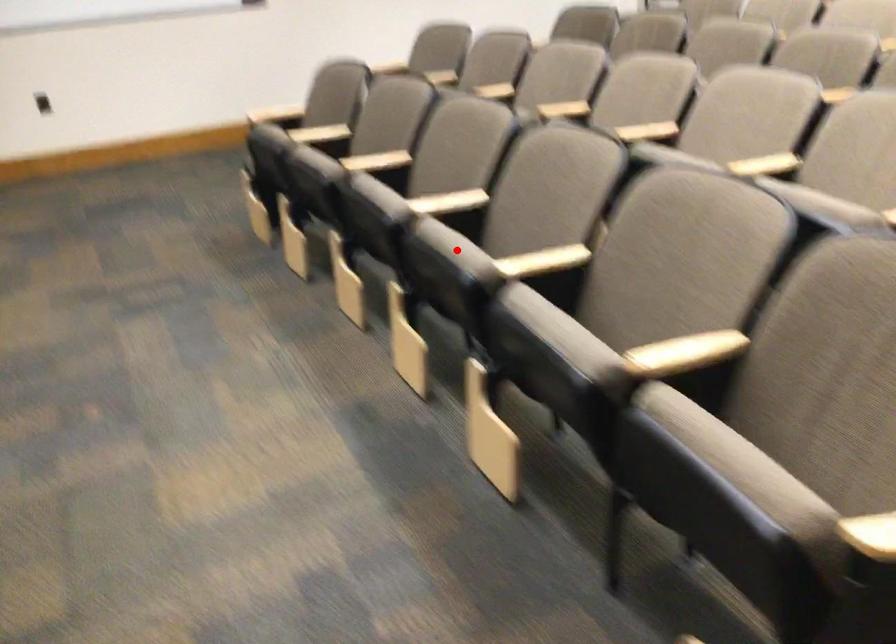
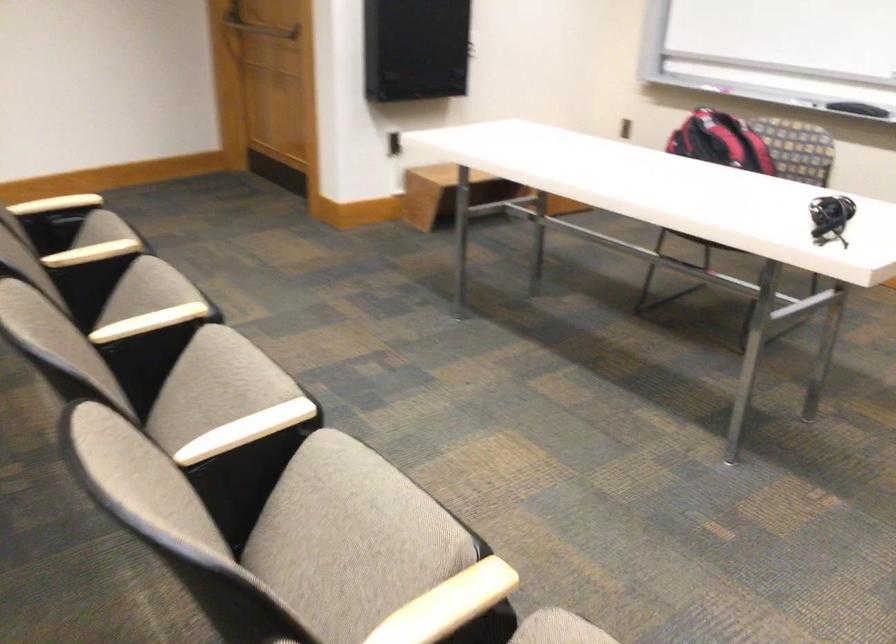
Question: I am providing you with two images of the same scene from different viewpoints. Image1 has a red point marked. In image2, the corresponding 3D location appears at what relative position? Reply with the corresponding letter.

Choices:
 (A) Closer
 (B) Farther

Answer: (A)